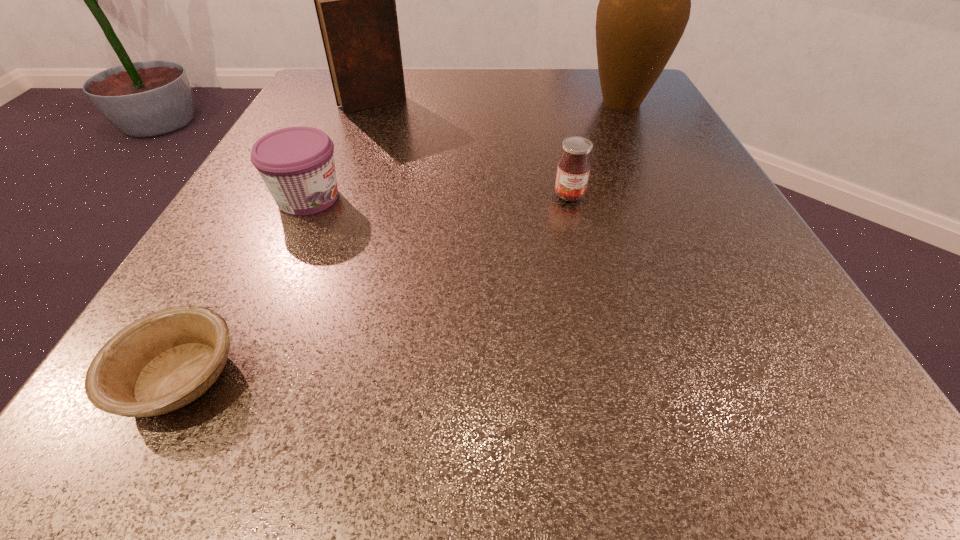
The width and height of the screenshot is (960, 540). I want to click on vacant space that is in between the left jam and the bowl, so (x=244, y=287).

The image size is (960, 540). In order to click on vacant space that is in between the tallest object and the Bible in this screenshot , I will do `click(497, 103)`.

Where is `unoccupied position between the Bible and the urn`? unoccupied position between the Bible and the urn is located at coordinates [497, 103].

Locate an element on the screen. vacant space in between the Bible and the left jam is located at coordinates (341, 151).

The height and width of the screenshot is (540, 960). I want to click on free area in between the Bible and the right jam, so click(471, 149).

You are a GUI agent. You are given a task and a screenshot of the screen. Output one action in this format:
    pyautogui.click(x=<x>, y=<y>)
    Task: Click on the free point between the rightmost object and the left jam
    The width and height of the screenshot is (960, 540).
    Given the screenshot: What is the action you would take?
    point(465,150)

Locate an element on the screen. Image resolution: width=960 pixels, height=540 pixels. empty location between the left jam and the Bible is located at coordinates coord(341,151).

Find the location of `object that stands as the second closest to the Bible`. object that stands as the second closest to the Bible is located at coordinates (573, 170).

Identify which object is located as the third nearest to the nearest object. Please provide its 2D coordinates. Your answer should be formatted as a tuple, i.e. [(x, y)], where the tuple contains the x and y coordinates of a point satisfying the conditions above.

[(355, 0)]

The width and height of the screenshot is (960, 540). I want to click on vacant position in the image that satisfies the following two spatial constraints: 1. on the label side of the right jam; 2. on the front label of the left jam, so click(x=570, y=198).